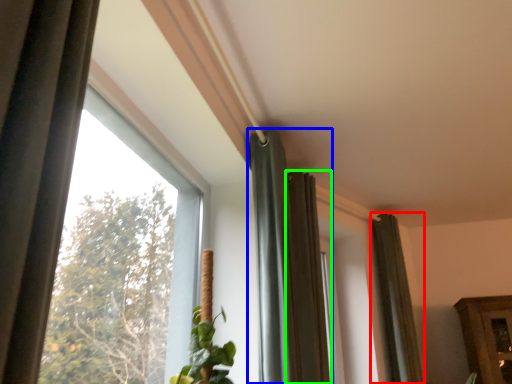
Question: Which is farther away from curtain (highlighted by a red box)? curtain (highlighted by a blue box) or curtain (highlighted by a green box)?

Choices:
 (A) curtain
 (B) curtain

Answer: (A)